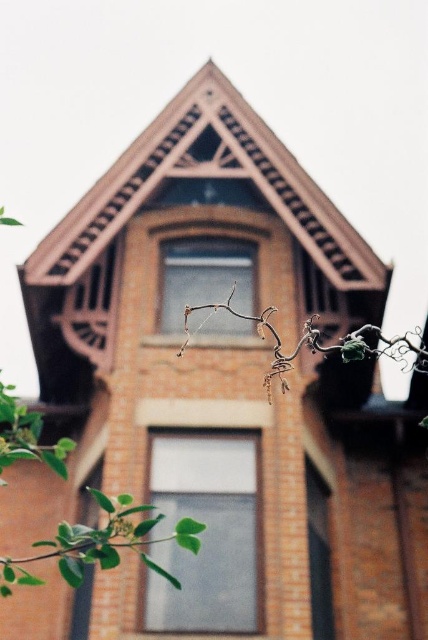
From the picture: Does transparent glass window at center appear over clear glass window at right?

Yes.

Where is `transparent glass window at center`? The height and width of the screenshot is (640, 428). transparent glass window at center is located at coordinates point(205,532).

Is point (187, 484) farther from camera compared to point (315, 490)?

No, (187, 484) is closer to viewer.

Find the location of a particular element. The image size is (428, 640). transparent glass window at center is located at coordinates (205, 532).

Who is positioned more to the right, green leafy branch at center or matte glass window at center?

Result: matte glass window at center

Can you confirm if green leafy branch at center is smaller than matte glass window at center?

Yes.

Find the location of `green leafy branch at center`. green leafy branch at center is located at coordinates (100, 544).

Does green leafy branch at center appear on the right side of brown textured branch at center?

Incorrect, green leafy branch at center is not on the right side of brown textured branch at center.

Is the position of green leafy branch at center more distant than that of brown textured branch at center?

Yes, green leafy branch at center is further from the viewer.

Between point (15, 449) and point (184, 344), which one is positioned in front?

Point (184, 344) is in front.

This screenshot has width=428, height=640. I want to click on green leafy branch at center, so click(x=100, y=544).